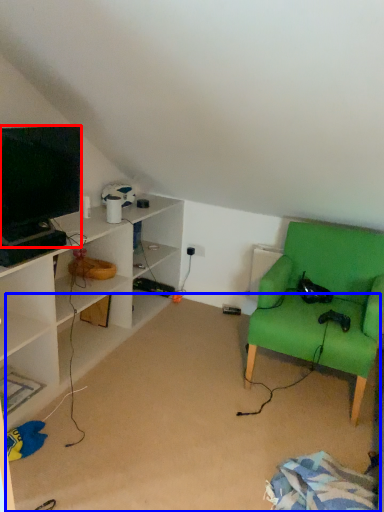
Question: Which point is further to the camera, television (highlighted by a red box) or plain (highlighted by a blue box)?

Choices:
 (A) television
 (B) plain

Answer: (A)